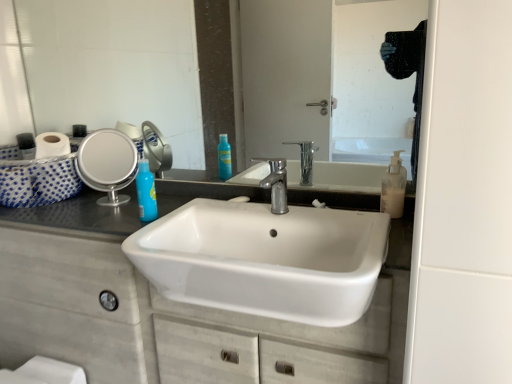
Question: Is polished chrome faucet at center located outside white ceramic sink at center?

Choices:
 (A) yes
 (B) no

Answer: (A)

Question: Can you confirm if polished chrome faucet at center is thinner than white ceramic sink at center?

Choices:
 (A) no
 (B) yes

Answer: (B)

Question: Is polished chrome faucet at center facing away from white ceramic sink at center?

Choices:
 (A) yes
 (B) no

Answer: (B)

Question: Are polished chrome faucet at center and white ceramic sink at center making contact?

Choices:
 (A) yes
 (B) no

Answer: (B)

Question: From the image's perspective, is polished chrome faucet at center under white ceramic sink at center?

Choices:
 (A) no
 (B) yes

Answer: (A)

Question: In terms of size, does white matte cabinet at center appear bigger or smaller than polished chrome faucet at center?

Choices:
 (A) small
 (B) big

Answer: (B)

Question: Considering the positions of white matte cabinet at center and polished chrome faucet at center in the image, is white matte cabinet at center taller or shorter than polished chrome faucet at center?

Choices:
 (A) short
 (B) tall

Answer: (B)

Question: Considering the positions of white matte cabinet at center and polished chrome faucet at center in the image, is white matte cabinet at center wider or thinner than polished chrome faucet at center?

Choices:
 (A) wide
 (B) thin

Answer: (A)

Question: From the image's perspective, is white matte cabinet at center positioned above or below polished chrome faucet at center?

Choices:
 (A) above
 (B) below

Answer: (B)

Question: From a real-world perspective, relative to white ceramic sink at center, is silver metallic mirror at left, the first mirror from the left, vertically above or below?

Choices:
 (A) below
 (B) above

Answer: (B)

Question: Looking at the image, does silver metallic mirror at left, the first mirror from the left, seem bigger or smaller compared to white ceramic sink at center?

Choices:
 (A) small
 (B) big

Answer: (A)

Question: Considering their positions, is silver metallic mirror at left, the 2th mirror viewed from the right, located in front of or behind white ceramic sink at center?

Choices:
 (A) front
 (B) behind

Answer: (B)

Question: From the image's perspective, is silver metallic mirror at left, the first mirror from the left, above or below white ceramic sink at center?

Choices:
 (A) below
 (B) above

Answer: (B)

Question: In the image, is glossy glass mirror at upper center, marked as the second mirror in a left-to-right arrangement, on the left side or the right side of blue glossy bottle at upper left?

Choices:
 (A) right
 (B) left

Answer: (A)

Question: Is point (295, 66) closer or farther from the camera than point (143, 173)?

Choices:
 (A) farther
 (B) closer

Answer: (A)